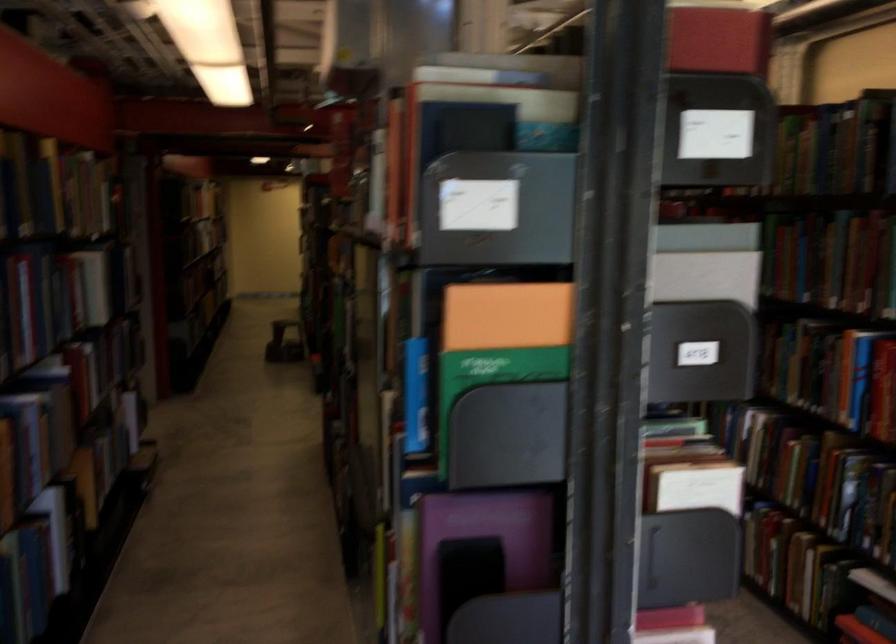
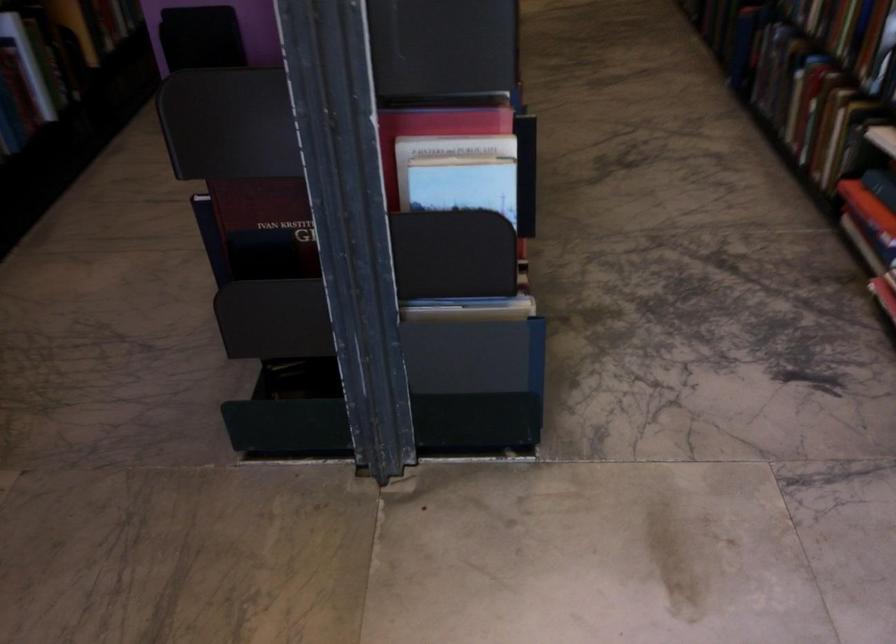
Question: The images are taken continuously from a first-person perspective. In which direction is your viewpoint rotating?

Choices:
 (A) Left
 (B) Right
 (C) Up
 (D) Down

Answer: (D)